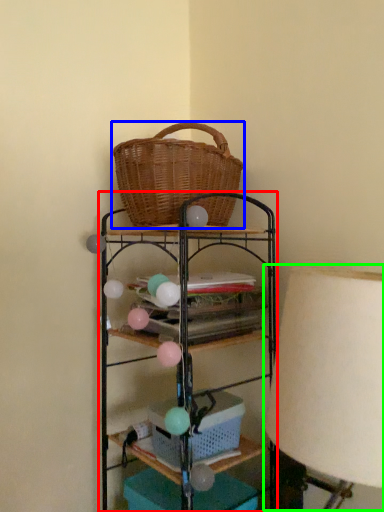
Question: Which is farther away from shelf (highlighted by a red box)? picnic basket (highlighted by a blue box) or table lamp (highlighted by a green box)?

Choices:
 (A) picnic basket
 (B) table lamp

Answer: (B)